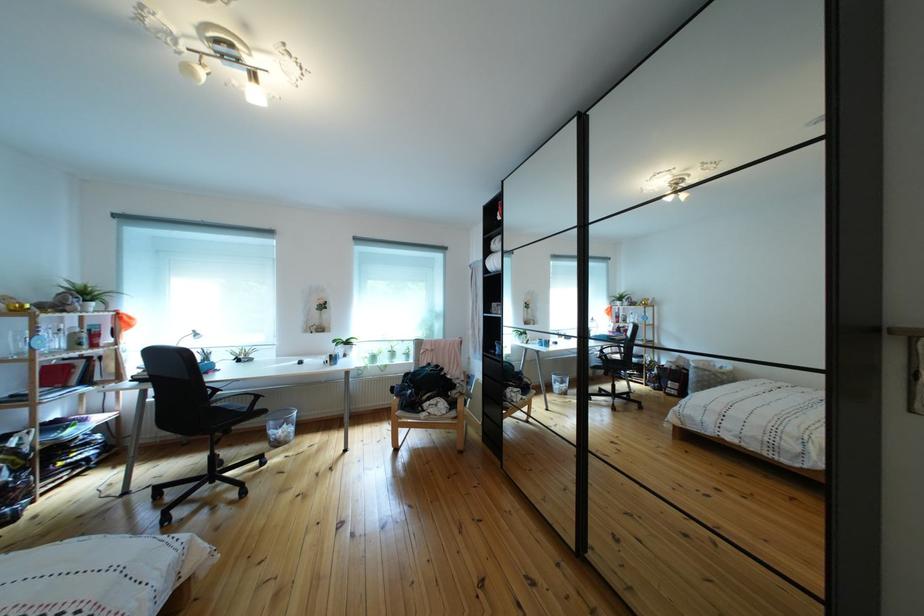
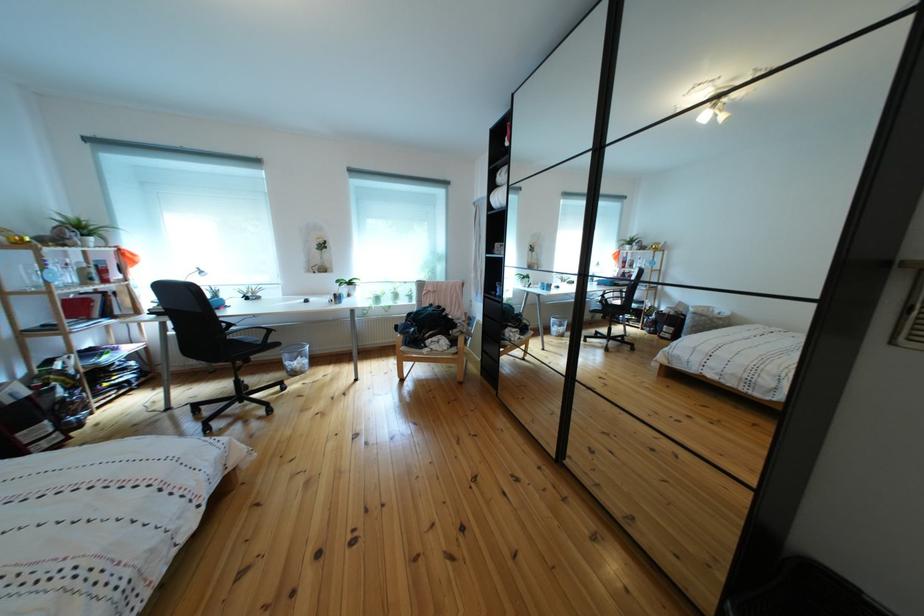
Where in the second image is the point corresponding to (x=225, y=411) from the first image?

(241, 342)